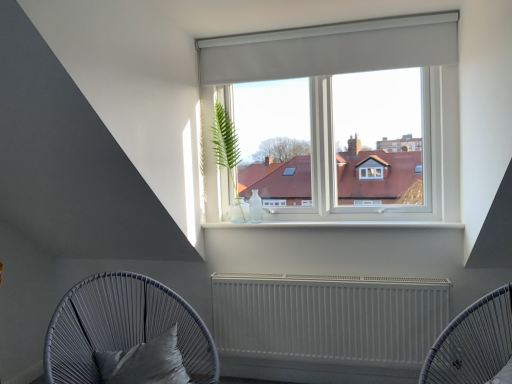
Question: Is white matte radiator at center shorter than white matte radiator at lower center, positioned as the 1th furniture in right-to-left order?

Choices:
 (A) no
 (B) yes

Answer: (B)

Question: Would you say white matte radiator at center is a long distance from white matte radiator at lower center, arranged as the 2th furniture when viewed from the left?

Choices:
 (A) no
 (B) yes

Answer: (A)

Question: Is white matte radiator at center oriented away from white matte radiator at lower center, positioned as the 1th furniture in right-to-left order?

Choices:
 (A) yes
 (B) no

Answer: (B)

Question: From a real-world perspective, is white matte radiator at center positioned under white matte radiator at lower center, positioned as the 1th furniture in right-to-left order, based on gravity?

Choices:
 (A) yes
 (B) no

Answer: (A)

Question: Is white matte radiator at center touching white matte radiator at lower center, arranged as the 2th furniture when viewed from the left?

Choices:
 (A) no
 (B) yes

Answer: (A)

Question: From a real-world perspective, is white matte radiator at center positioned over white matte radiator at lower center, positioned as the 1th furniture in right-to-left order, based on gravity?

Choices:
 (A) yes
 (B) no

Answer: (B)

Question: Can you confirm if white matte radiator at lower center, positioned as the 1th furniture in right-to-left order, is positioned to the left of green leafy plant in glass vase at upper left?

Choices:
 (A) no
 (B) yes

Answer: (A)

Question: Is white matte radiator at lower center, arranged as the 2th furniture when viewed from the left, wider than green leafy plant in glass vase at upper left?

Choices:
 (A) no
 (B) yes

Answer: (B)

Question: Considering the relative sizes of white matte radiator at lower center, positioned as the 1th furniture in right-to-left order, and green leafy plant in glass vase at upper left in the image provided, is white matte radiator at lower center, positioned as the 1th furniture in right-to-left order, taller than green leafy plant in glass vase at upper left?

Choices:
 (A) no
 (B) yes

Answer: (A)

Question: Can you confirm if white matte radiator at lower center, positioned as the 1th furniture in right-to-left order, is smaller than green leafy plant in glass vase at upper left?

Choices:
 (A) yes
 (B) no

Answer: (B)

Question: Is white matte radiator at lower center, positioned as the 1th furniture in right-to-left order, facing away from green leafy plant in glass vase at upper left?

Choices:
 (A) yes
 (B) no

Answer: (B)

Question: Is white matte radiator at lower center, positioned as the 1th furniture in right-to-left order, not inside green leafy plant in glass vase at upper left?

Choices:
 (A) no
 (B) yes

Answer: (B)

Question: Is white matte radiator at center behind green leafy plant in glass vase at upper left?

Choices:
 (A) yes
 (B) no

Answer: (B)